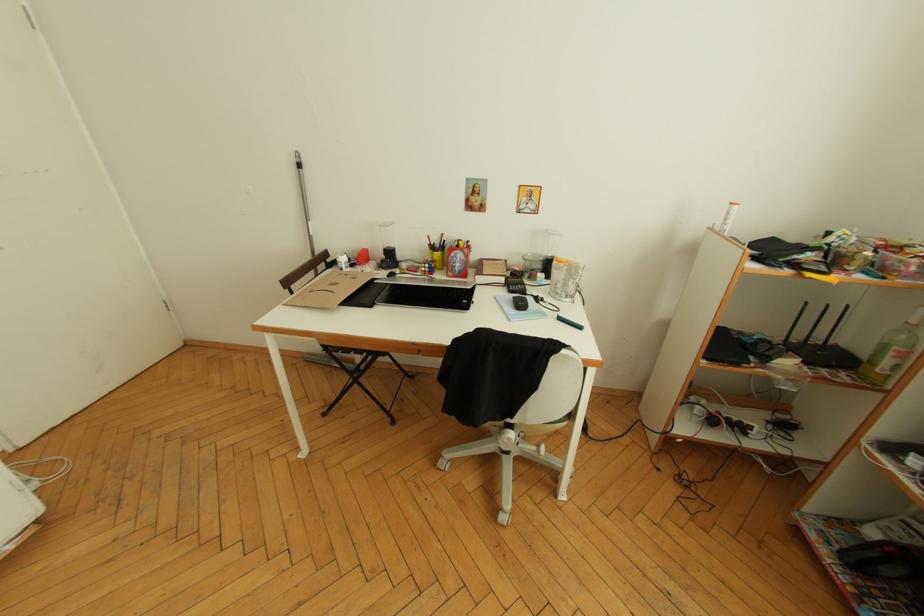
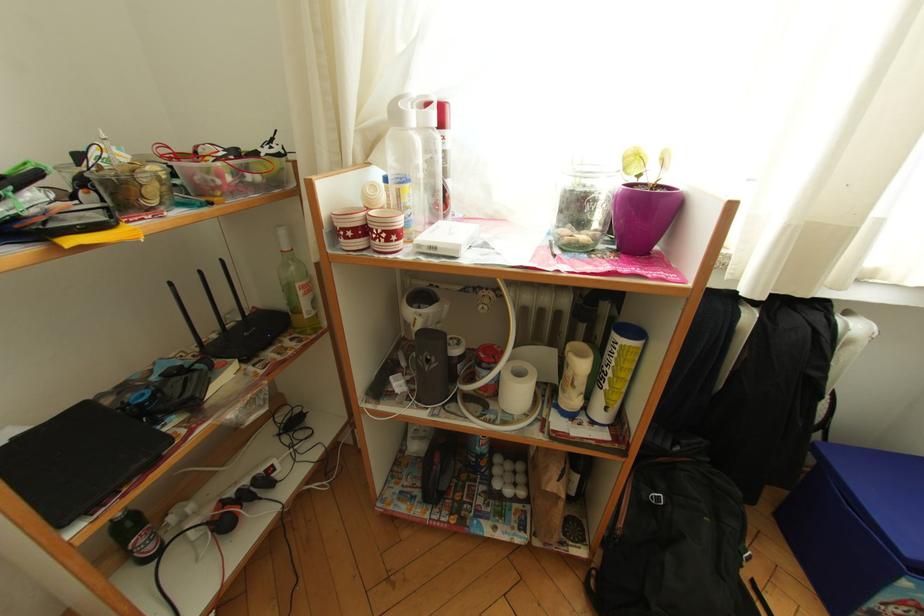
How did the camera likely rotate?

The rotation direction of the camera is right-down.